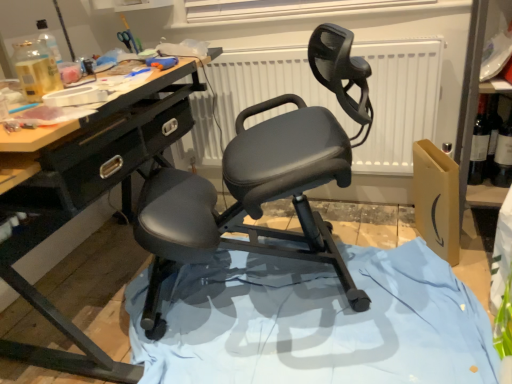
Question: Is blue fabric at center wider or thinner than matte black ergonomic chair at center?

Choices:
 (A) thin
 (B) wide

Answer: (B)

Question: From a real-world perspective, is blue fabric at center physically located above or below matte black ergonomic chair at center?

Choices:
 (A) below
 (B) above

Answer: (A)

Question: Based on their relative distances, which object is farther from the matte black ergonomic chair at center?

Choices:
 (A) white matte radiator at center
 (B) white matte window screen at upper center
 (C) blue fabric at center
 (D) dark glass wine bottle at right

Answer: (D)

Question: Estimate the real-world distances between objects in this image. Which object is closer to the dark glass wine bottle at right?

Choices:
 (A) white matte radiator at center
 (B) blue fabric at center
 (C) matte black ergonomic chair at center
 (D) white matte window screen at upper center

Answer: (A)